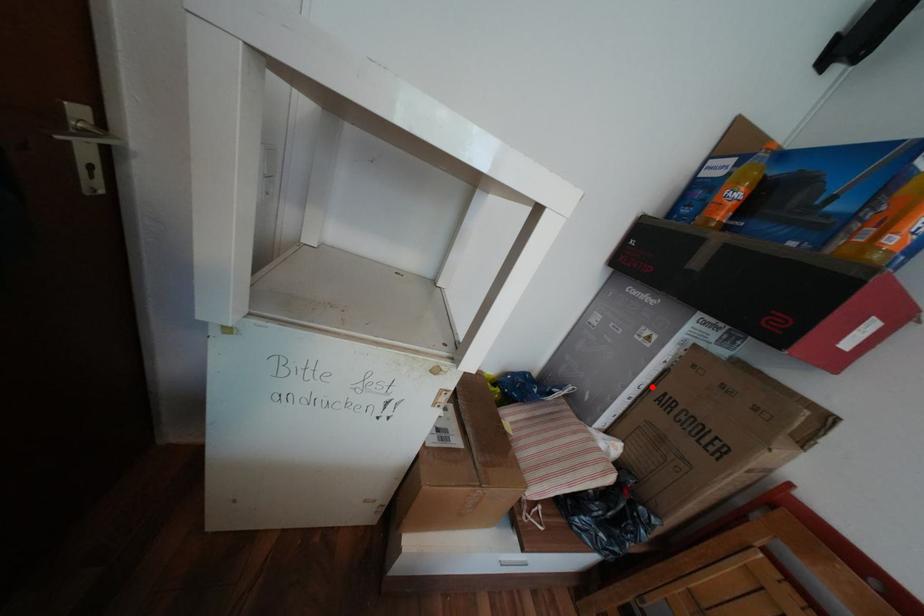
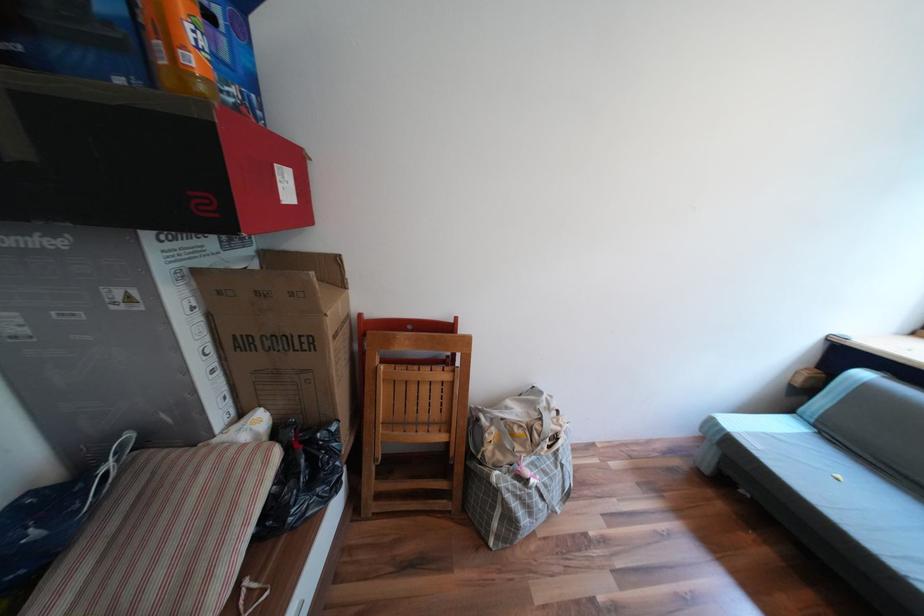
In the second image, find the point that corresponds to the highlighted location in the first image.

(219, 349)